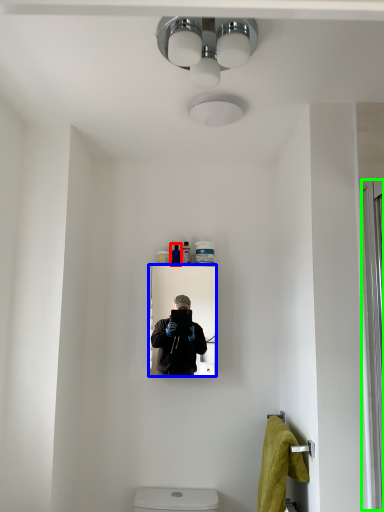
Question: Based on their relative distances, which object is nearer to toiletry (highlighted by a red box)? Choose from mirror (highlighted by a blue box) and screen door (highlighted by a green box).

Choices:
 (A) mirror
 (B) screen door

Answer: (A)